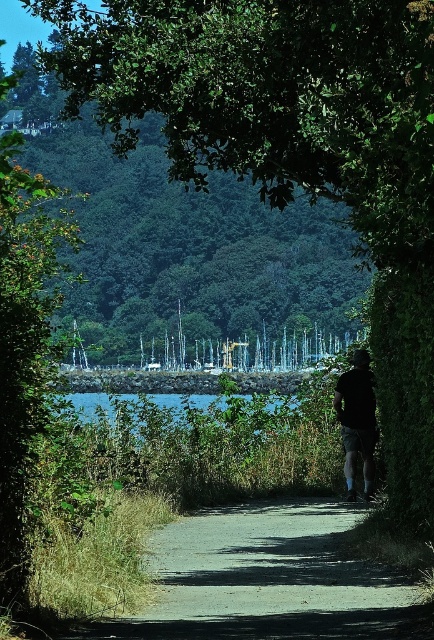
You are standing at the starting point of the path in the scene. There is a gray gravel path at center. If you were to walk straight ahead, would you eventually reach the point labeled as point (268, 580)?

Yes, because the gray gravel path at center continues straight ahead and the point (268, 580) is located along this path.

You are a gardener planning to walk along the gray gravel path at center while carrying a wheelbarrow that is 1 meter wide. The black cotton shirt at center belongs to a pedestrian walking ahead. Can you safely pass the pedestrian without moving off the path?

The gray gravel path at center might be wider than black cotton shirt at center. If the path is indeed wider than 1 meter, you can safely pass the pedestrian while staying on the path. However, if the path is narrower, you may need to step aside.

You are standing at the starting point of the path in the image. You see two points marked on the path ahead of you. The first point is at coordinates point (358,579) and the second point is at point (345,472). Which point is closer to you as you walk along the path?

Point (358,579) is in front of point (345,472), so the first point you encounter as you walk along the path is point (358,579).